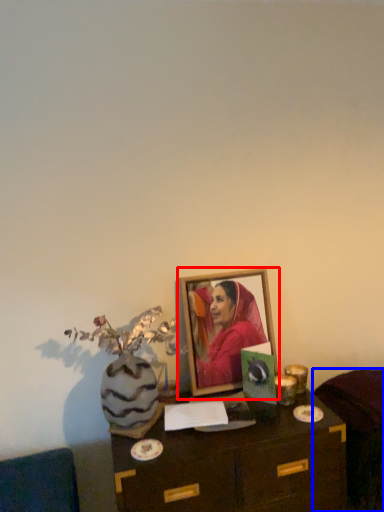
Question: Which of the following is the farthest to the observer, picture frame (highlighted by a red box) or furniture (highlighted by a blue box)?

Choices:
 (A) picture frame
 (B) furniture

Answer: (A)